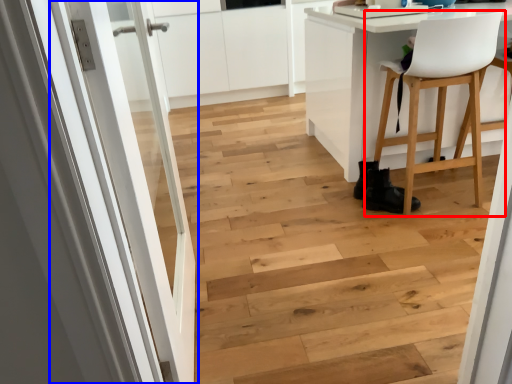
Question: Which object appears farthest to the camera in this image, chair (highlighted by a red box) or door (highlighted by a blue box)?

Choices:
 (A) chair
 (B) door

Answer: (A)